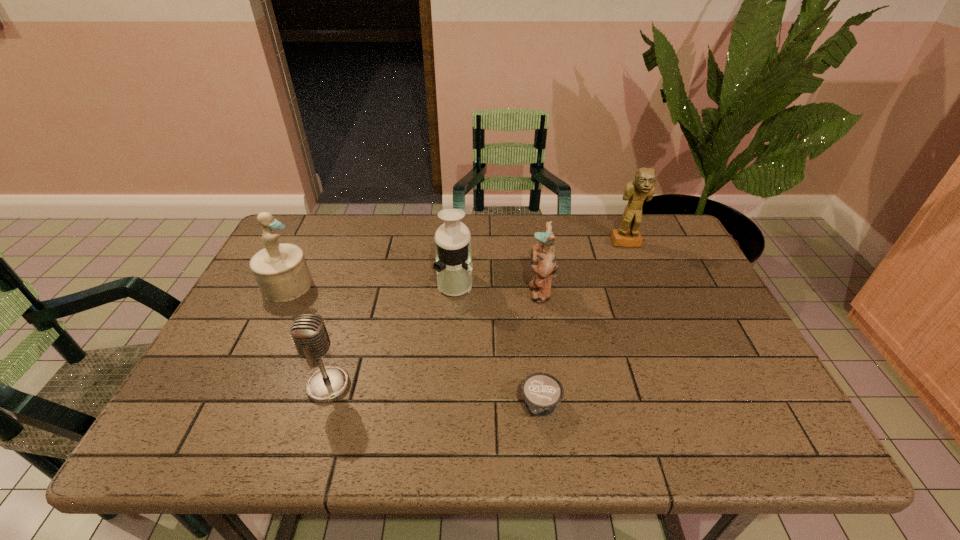
What are the coordinates of `blank space located 0.120m on the front-facing side of the second figurine from right to left` in the screenshot? It's located at (484, 291).

Where is `free region located on the front-facing side of the second figurine from right to left`? free region located on the front-facing side of the second figurine from right to left is located at coordinates (422, 291).

At what (x,y) coordinates should I click in order to perform the action: click on vacant space located 0.060m on the front-facing side of the second figurine from right to left. Please return your answer as a coordinate pair (x, y). Looking at the image, I should click on (506, 291).

I want to click on vacant area situated on the front of the microphone, so click(307, 453).

You are a GUI agent. You are given a task and a screenshot of the screen. Output one action in this format:
    pyautogui.click(x=<x>, y=<y>)
    Task: Click on the free point located 0.320m on the left of the shortest object
    The width and height of the screenshot is (960, 540).
    Given the screenshot: What is the action you would take?
    pyautogui.click(x=371, y=407)

Where is `object present at the far edge`? Image resolution: width=960 pixels, height=540 pixels. object present at the far edge is located at coordinates (642, 188).

Where is `object positioned at the near edge`? The height and width of the screenshot is (540, 960). object positioned at the near edge is located at coordinates (542, 392).

The image size is (960, 540). What are the coordinates of `object at the left edge` in the screenshot? It's located at (281, 271).

The height and width of the screenshot is (540, 960). I want to click on object located at the right edge, so click(642, 188).

Locate an element on the screen. object located in the far right corner section of the desktop is located at coordinates (642, 188).